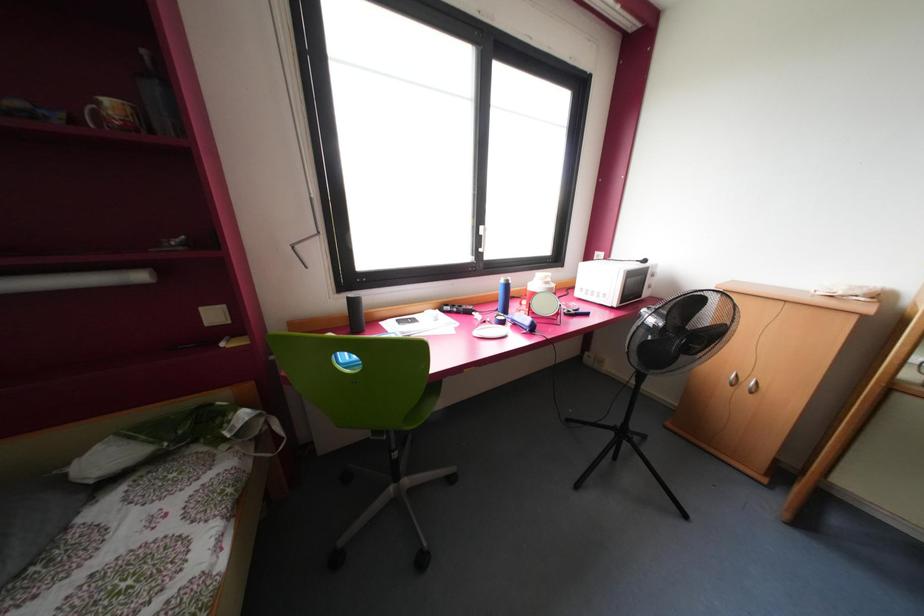
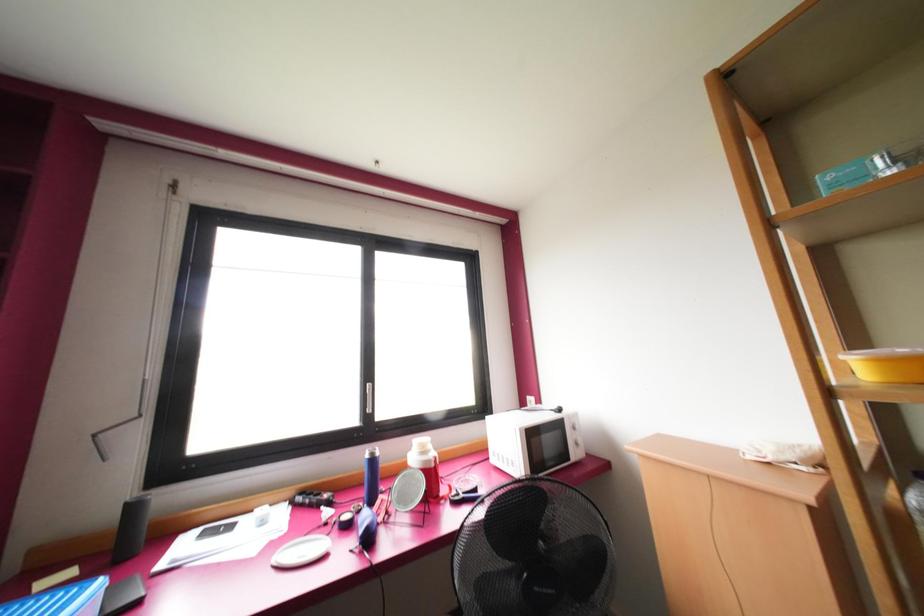
Question: The images are taken continuously from a first-person perspective. In which direction is your viewpoint rotating?

Choices:
 (A) Left
 (B) Right
 (C) Up
 (D) Down

Answer: (C)